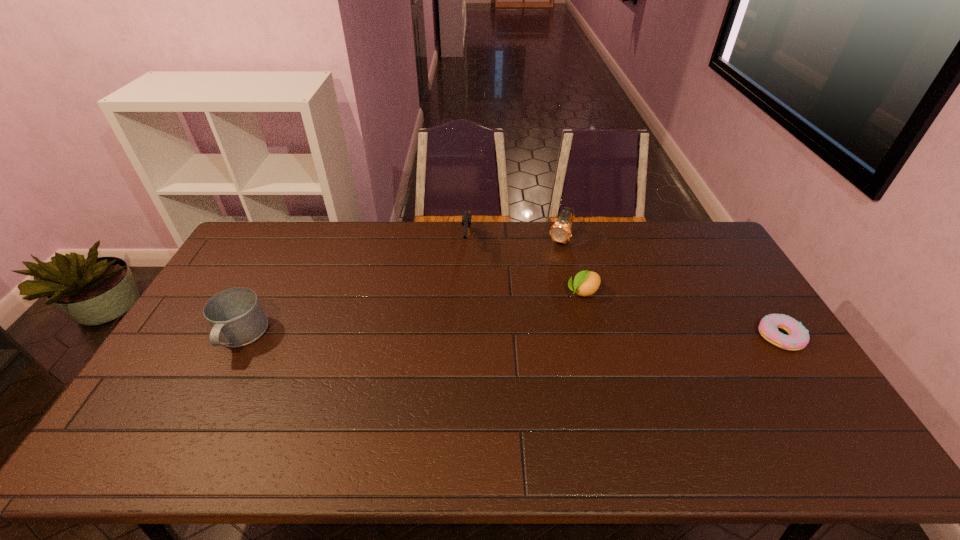
This screenshot has height=540, width=960. Identify the location of vacant space on the desktop that is between the mug and the doughnut and is positioned with leaves positioned above the lemon. (523, 336).

Where is `vacant space on the desktop that is between the leftmost object and the rightmost object and is positioned on the face of the watch`? The width and height of the screenshot is (960, 540). vacant space on the desktop that is between the leftmost object and the rightmost object and is positioned on the face of the watch is located at coordinates (510, 336).

Where is `free space on the desktop that is between the leftmost object and the doughnut and is positioned along the barrel of the gun`? This screenshot has height=540, width=960. free space on the desktop that is between the leftmost object and the doughnut and is positioned along the barrel of the gun is located at coordinates (461, 336).